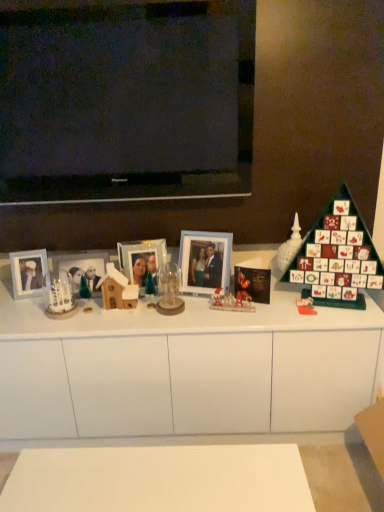
Locate an element on the screen. vacant region to the left of translucent plastic figurines at center, placed as the third toy when sorted from right to left is located at coordinates (196, 312).